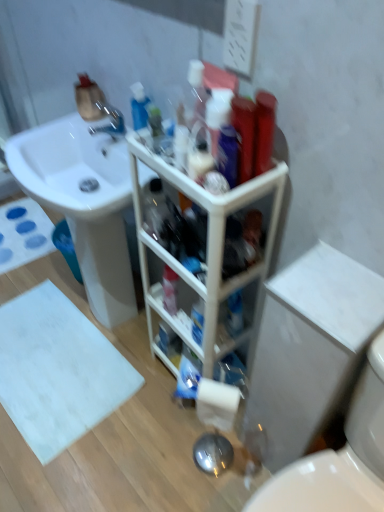
Question: From a real-world perspective, relative to white glossy toilet at lower right, is metallic silver faucet at upper left vertically above or below?

Choices:
 (A) below
 (B) above

Answer: (B)

Question: In terms of height, does metallic silver faucet at upper left look taller or shorter compared to white glossy toilet at lower right?

Choices:
 (A) tall
 (B) short

Answer: (B)

Question: Which is farther from the white glossy sink at upper left?

Choices:
 (A) white matte toilet paper at lower center
 (B) metallic silver faucet at upper left
 (C) white matte bath mat at lower left, positioned as the 2th bath mat in top-to-bottom order
 (D) white matte bath mat at lower left, acting as the second bath mat starting from the bottom
 (E) white plastic cabinet at center

Answer: (D)

Question: Which is nearer to the white matte bath mat at lower left, which is the 1th bath mat in back-to-front order?

Choices:
 (A) white plastic cabinet at center
 (B) white glossy sink at upper left
 (C) white matte toilet paper at lower center
 (D) white glossy toilet at lower right
 (E) metallic silver faucet at upper left

Answer: (B)